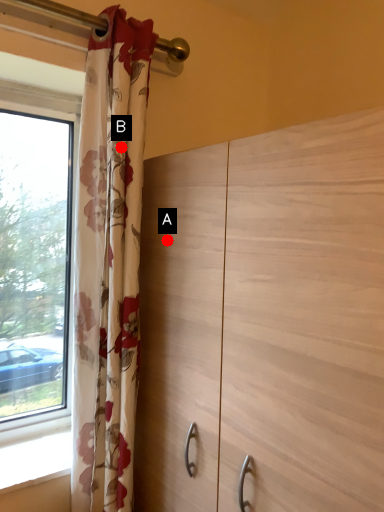
Question: Two points are circled on the image, labeled by A and B beside each circle. Which point is closer to the camera taking this photo?

Choices:
 (A) A is closer
 (B) B is closer

Answer: (B)